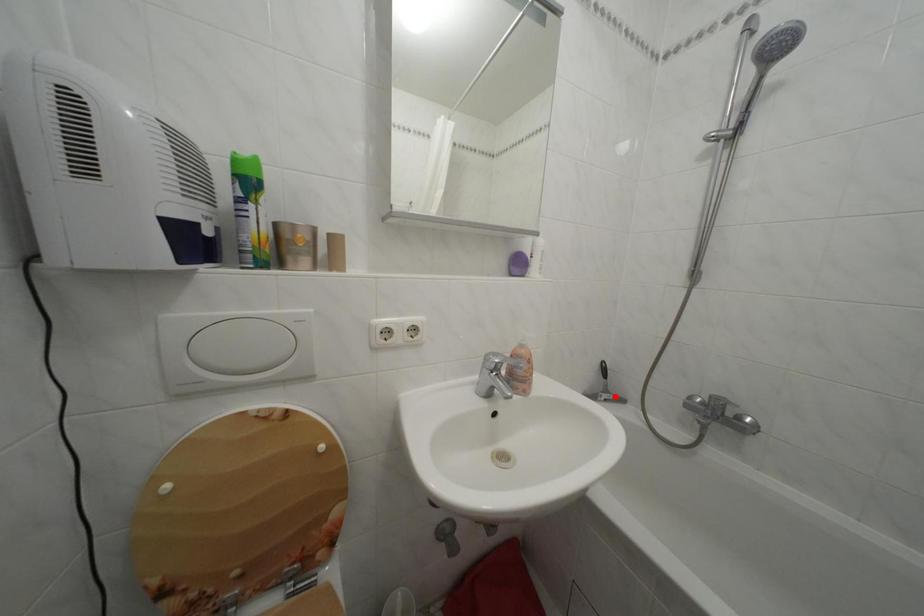
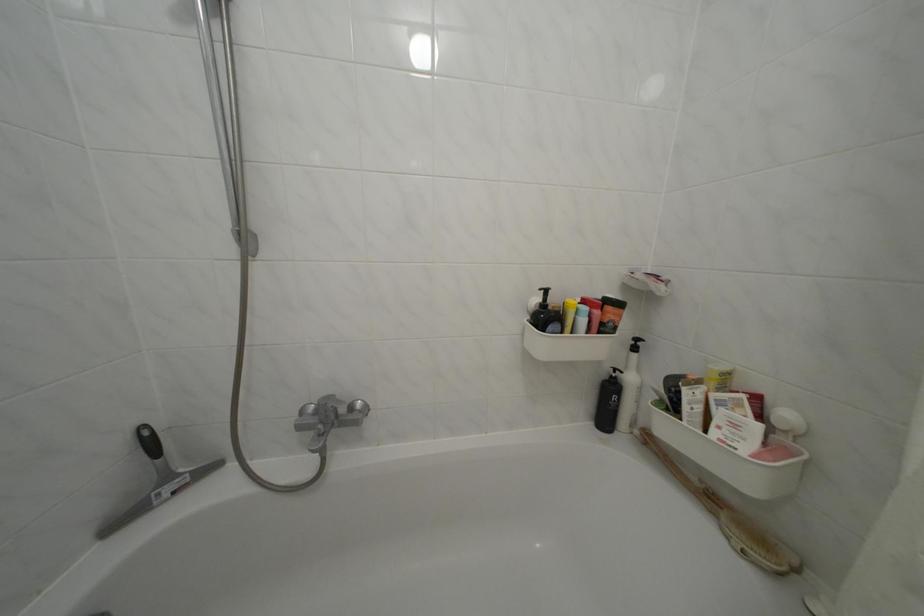
Question: I am providing you with two images of the same scene from different viewpoints. Image1 has a red point marked. In image2, the corresponding 3D location appears at what relative position? Reply with the corresponding letter.

Choices:
 (A) Closer
 (B) Farther

Answer: (A)